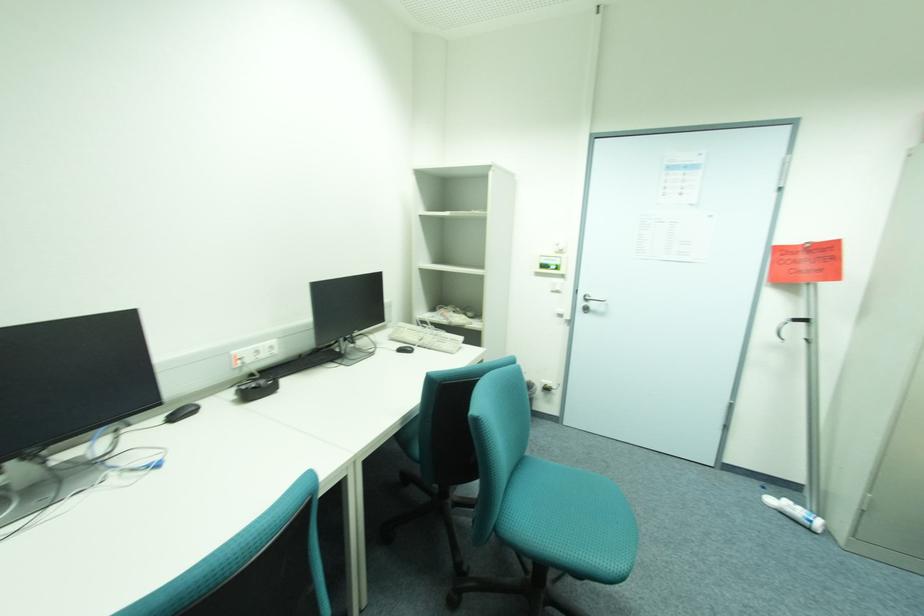
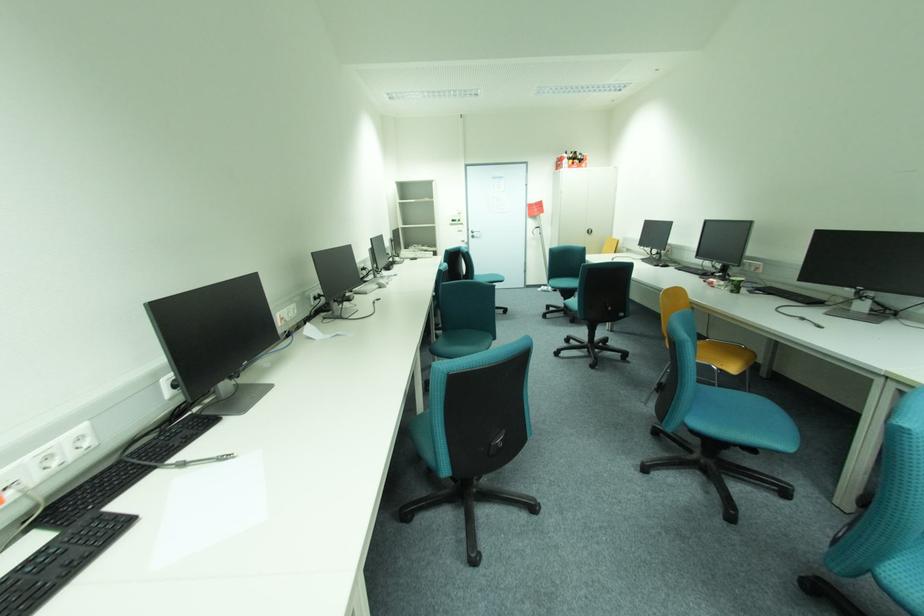
Locate, in the second image, the point that corresponds to the point at 589,304 in the first image.

(477, 235)